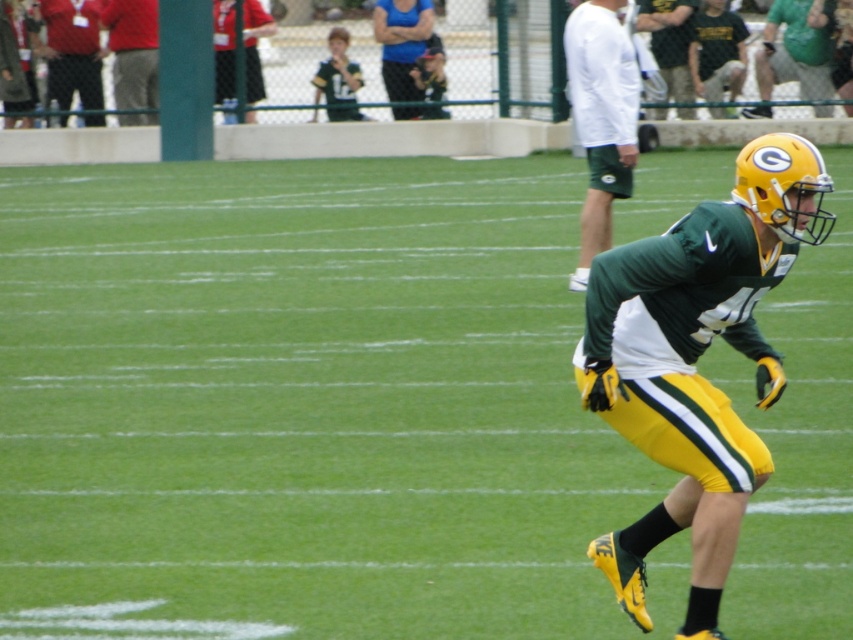
Question: Among these objects, which one is farthest from the camera?

Choices:
 (A) red fabric pants at upper left
 (B) green/yellow uniform at center
 (C) matte blue tank top at upper center

Answer: (A)

Question: Is green/yellow uniform at center above matte blue tank top at upper center?

Choices:
 (A) no
 (B) yes

Answer: (A)

Question: Observing the image, what is the correct spatial positioning of green/yellow uniform at center in reference to dark green jersey at upper right?

Choices:
 (A) right
 (B) left

Answer: (A)

Question: Which object is the closest to the green/yellow uniform at center?

Choices:
 (A) matte green jersey at center
 (B) white long-sleeve shirt at upper center

Answer: (A)

Question: Estimate the real-world distances between objects in this image. Which object is farther from the matte blue tank top at upper center?

Choices:
 (A) red shirt at upper left
 (B) green matte uniform at right

Answer: (B)

Question: From the image, what is the correct spatial relationship of matte blue tank top at upper center in relation to red shirt at upper left?

Choices:
 (A) left
 (B) right

Answer: (B)